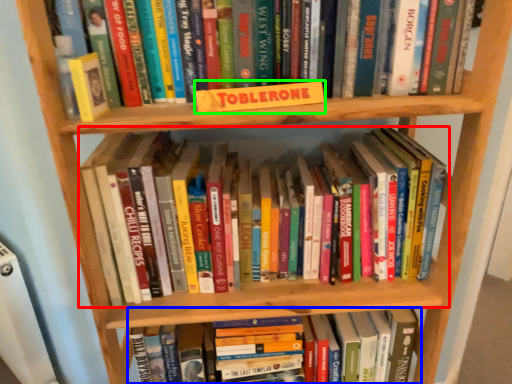
Question: Considering the real-world distances, which object is closest to book (highlighted by a red box)? book (highlighted by a blue box) or paperback book (highlighted by a green box).

Choices:
 (A) book
 (B) paperback book

Answer: (B)